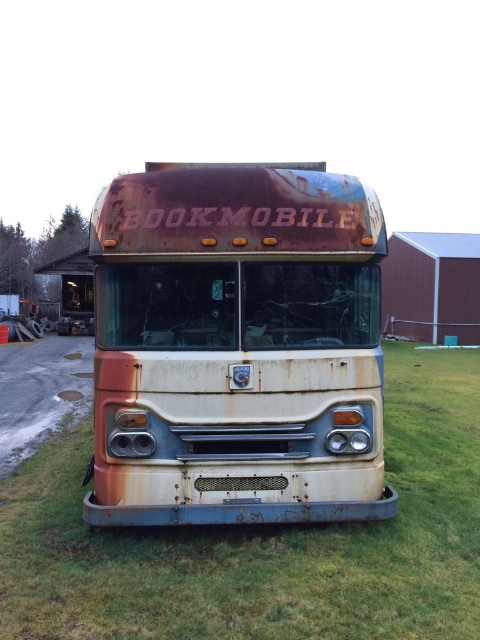
Question: Can you confirm if rusty metal bookmobile at center is positioned above rusty metal bus at center?

Choices:
 (A) yes
 (B) no

Answer: (A)

Question: Among these points, which one is farthest from the camera?

Choices:
 (A) (119, 488)
 (B) (56, 632)

Answer: (A)

Question: Does rusty metal bookmobile at center appear on the left side of rusty metal bus at center?

Choices:
 (A) no
 (B) yes

Answer: (B)

Question: Is rusty metal bookmobile at center to the left of rusty metal bus at center from the viewer's perspective?

Choices:
 (A) yes
 (B) no

Answer: (A)

Question: Which object appears closest to the camera in this image?

Choices:
 (A) rusty metal bookmobile at center
 (B) rusty metal bus at center

Answer: (B)